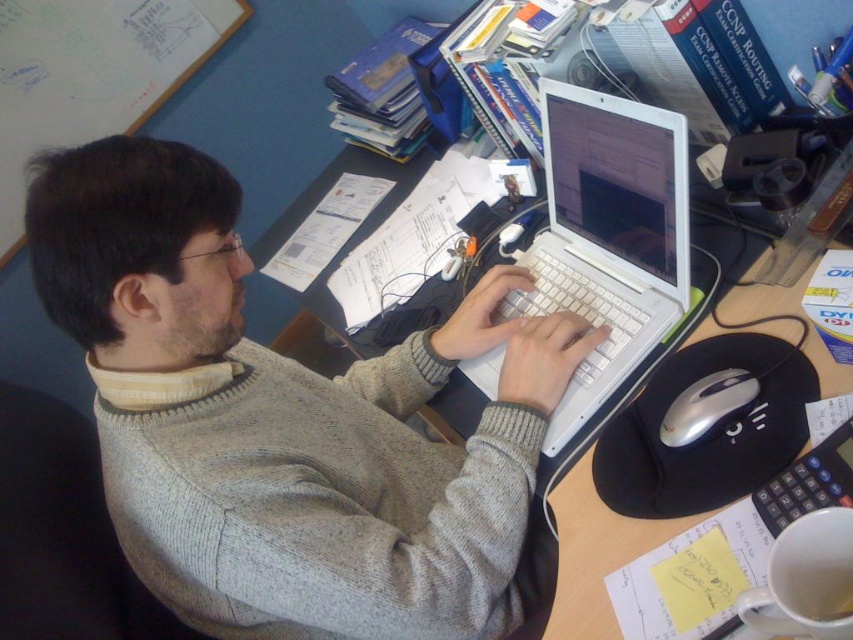
Question: Which of the following is the closest to the observer?

Choices:
 (A) (637, 113)
 (B) (488, 570)
 (C) (727, 397)

Answer: (C)

Question: Is gray sweater at center further to the viewer compared to white glossy laptop at center?

Choices:
 (A) yes
 (B) no

Answer: (B)

Question: Is white plastic laptop at center closer to camera compared to wooden desk at center?

Choices:
 (A) no
 (B) yes

Answer: (A)

Question: Among these objects, which one is nearest to the camera?

Choices:
 (A) silver metallic mouse at lower right
 (B) gray sweater at center
 (C) wooden desk at center

Answer: (B)

Question: Estimate the real-world distances between objects in this image. Which object is closer to the wooden desk at center?

Choices:
 (A) silver metallic mouse at lower right
 (B) gray sweater at center
 (C) white plastic laptop at center
 (D) white glossy laptop at center

Answer: (C)

Question: Is gray sweater at center to the left of wooden desk at center from the viewer's perspective?

Choices:
 (A) no
 (B) yes

Answer: (B)